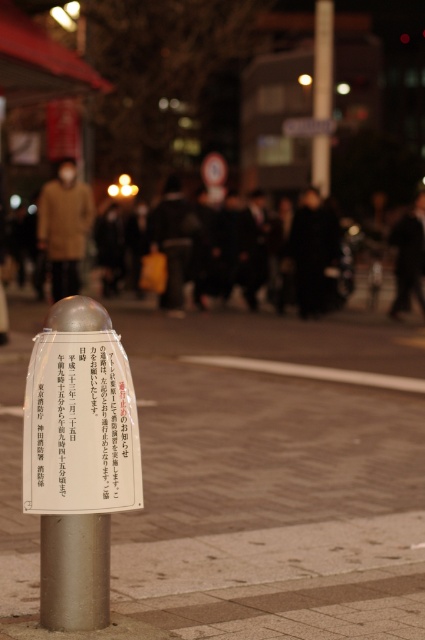
You are standing at the pedestrian crossing near the metallic bollard with the white sign. There are two points marked on the ground ahead of you. The first point is located at coordinates point [339,573] and the second at point [314,152]. Which point is closer to you?

Point [339,573] is closer to the viewer than point [314,152].